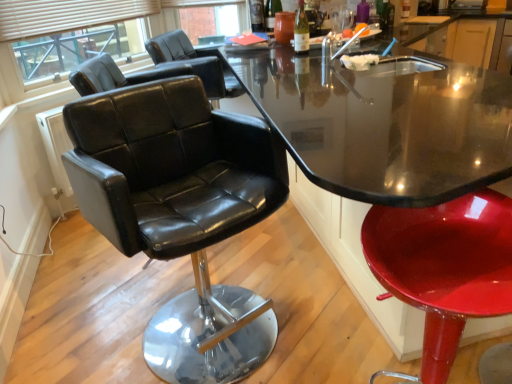
This screenshot has height=384, width=512. I want to click on free space to the back side of glossy red stool at lower right, which is counted as the third chair, starting from the back, so click(x=358, y=351).